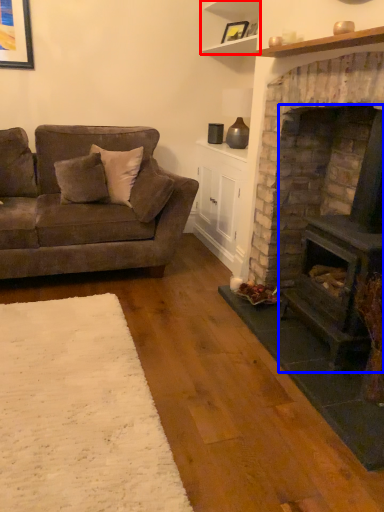
Question: Which object is closer to the camera taking this photo, shelf (highlighted by a red box) or wood burning stove (highlighted by a blue box)?

Choices:
 (A) shelf
 (B) wood burning stove

Answer: (B)